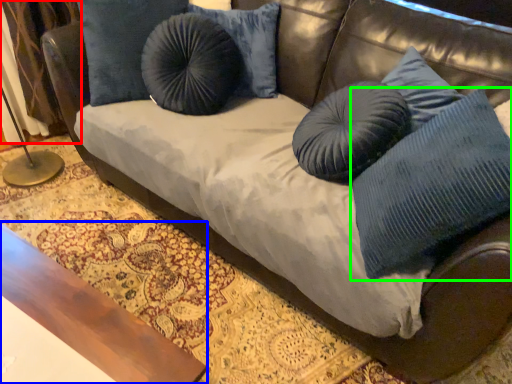
Question: Which is nearer to the curtain (highlighted by a red box)? table (highlighted by a blue box) or pillow (highlighted by a green box).

Choices:
 (A) table
 (B) pillow

Answer: (A)